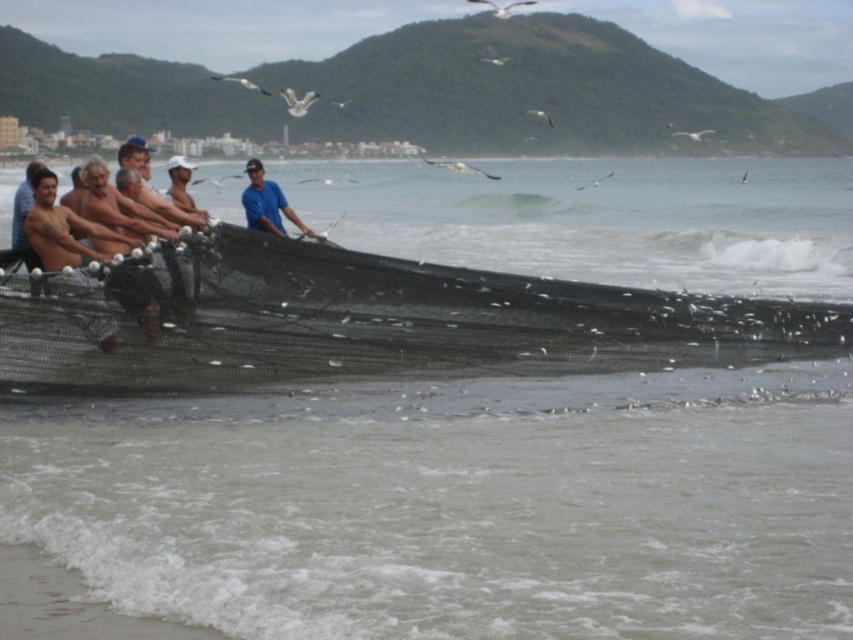
Is black mesh net at center bigger than blue matte shirt at center?

No.

Which is more to the right, black mesh net at center or blue matte shirt at center?

Positioned to the right is black mesh net at center.

The width and height of the screenshot is (853, 640). Describe the element at coordinates (361, 321) in the screenshot. I see `black mesh net at center` at that location.

You are a GUI agent. You are given a task and a screenshot of the screen. Output one action in this format:
    pyautogui.click(x=<x>, y=<y>)
    Task: Click on the black mesh net at center
    Image resolution: width=853 pixels, height=640 pixels.
    Given the screenshot: What is the action you would take?
    pyautogui.click(x=361, y=321)

Can you confirm if black mesh net at center is taller than smooth skin torso at left?

No, black mesh net at center is not taller than smooth skin torso at left.

Is black mesh net at center smaller than smooth skin torso at left?

Indeed, black mesh net at center has a smaller size compared to smooth skin torso at left.

Who is more forward, (117, 348) or (67, 280)?

Positioned in front is point (67, 280).

This screenshot has width=853, height=640. I want to click on black mesh net at center, so click(361, 321).

Is smooth skin torso at left above blue matte shirt at center?

Actually, smooth skin torso at left is below blue matte shirt at center.

Who is more distant from viewer, (45,180) or (281,236)?

Point (281,236)

Find the location of a particular element. smooth skin torso at left is located at coordinates (73, 253).